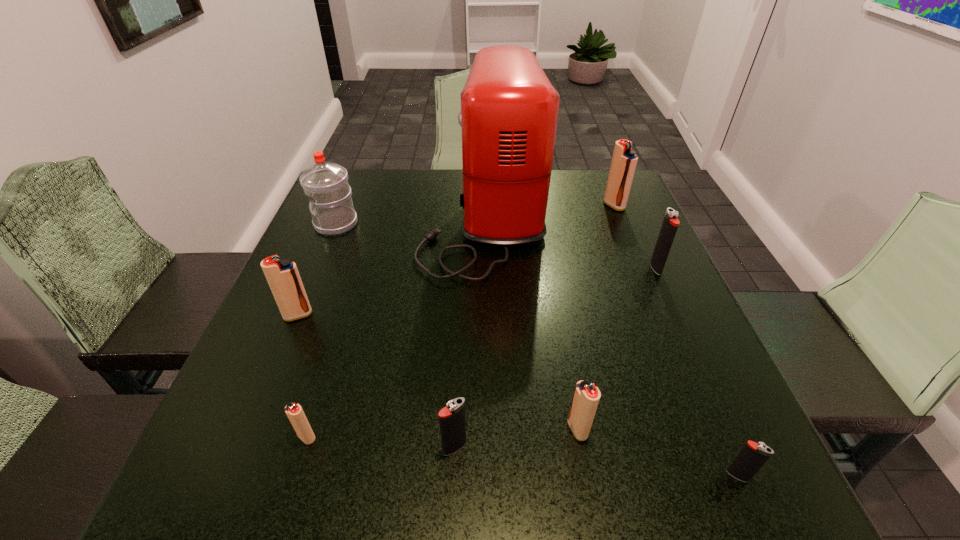
The image size is (960, 540). What are the coordinates of `free region that satisfies the following two spatial constraints: 1. on the handle side of the second smallest red igniter; 2. on the right side of the white water bottle` in the screenshot? It's located at (251, 429).

Locate an element on the screen. free point that satisfies the following two spatial constraints: 1. on the back side of the nearest black igniter; 2. on the left side of the biggest black igniter is located at coordinates (648, 268).

Locate an element on the screen. The image size is (960, 540). free spot that satisfies the following two spatial constraints: 1. on the handle side of the sixth igniter from right to left; 2. on the right side of the white water bottle is located at coordinates (247, 437).

At what (x,y) coordinates should I click in order to perform the action: click on blank area in the image that satisfies the following two spatial constraints: 1. on the front-facing side of the kitchen mixer; 2. on the left side of the biggest black igniter. Please return your answer as a coordinate pair (x, y). Looking at the image, I should click on (485, 268).